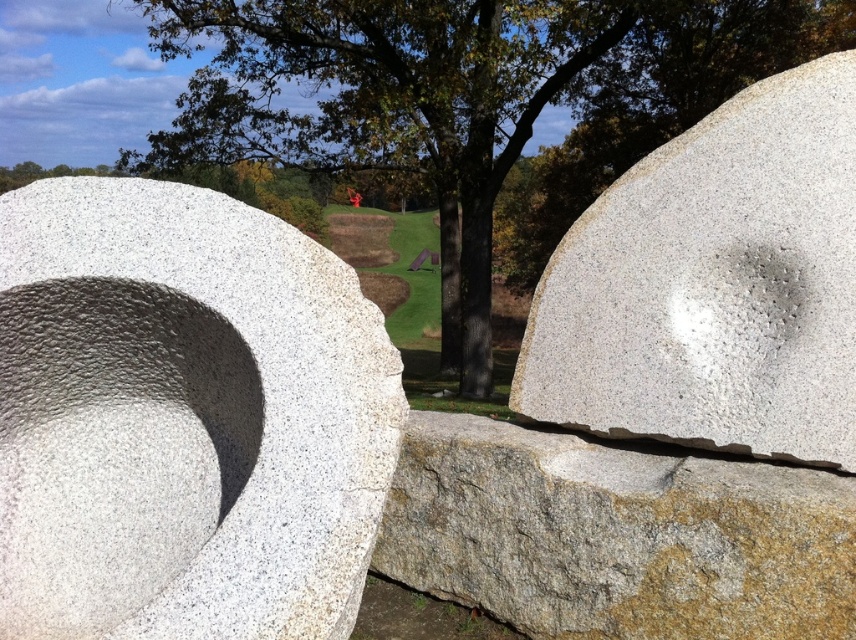
Locate an element on the screen. The height and width of the screenshot is (640, 856). white granite stone at center is located at coordinates (714, 284).

Who is more forward, (800, 337) or (765, 584)?

Positioned in front is point (765, 584).

Image resolution: width=856 pixels, height=640 pixels. Identify the location of white granite stone at center. (714, 284).

Is point (122, 388) less distant than point (629, 104)?

Yes, it is in front of point (629, 104).

How distant is white textured stone at center from green leafy tree at center?

They are 12.73 meters apart.

What do you see at coordinates (183, 417) in the screenshot? I see `white textured stone at center` at bounding box center [183, 417].

I want to click on white textured stone at center, so click(x=183, y=417).

Which of these two, green leafy tree at center or white granite stone at center, stands taller?

Standing taller between the two is green leafy tree at center.

Who is more distant from viewer, (272, 19) or (742, 312)?

Positioned behind is point (272, 19).

Find the location of a particular element. green leafy tree at center is located at coordinates (473, 100).